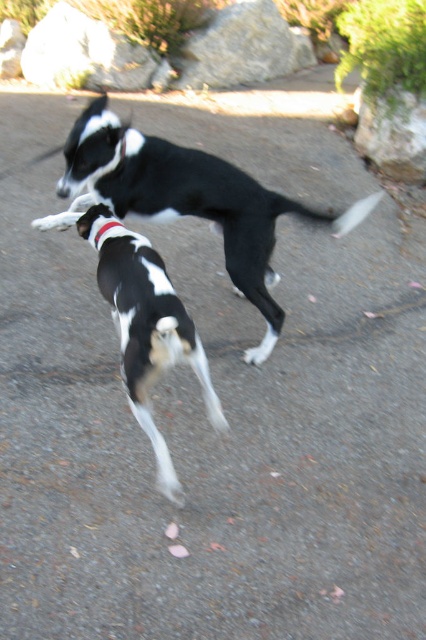
Does black and white fur at center appear on the right side of red fabric neckband at center?

Indeed, black and white fur at center is positioned on the right side of red fabric neckband at center.

Measure the distance between point [150,340] and camera.

They are 7.26 feet apart.

Find the location of a particular element. Image resolution: width=426 pixels, height=640 pixels. black and white fur at center is located at coordinates (150, 336).

Looking at this image, is black and white fur dog at center bigger than red fabric neckband at center?

Indeed, black and white fur dog at center has a larger size compared to red fabric neckband at center.

Consider the image. Does black and white fur dog at center have a greater width compared to red fabric neckband at center?

Yes.

This screenshot has width=426, height=640. What do you see at coordinates (187, 200) in the screenshot?
I see `black and white fur dog at center` at bounding box center [187, 200].

Where is `black and white fur dog at center`? The image size is (426, 640). black and white fur dog at center is located at coordinates (187, 200).

Is point (370, 196) in front of point (207, 400)?

No, (370, 196) is further to viewer.

Which is behind, point (63, 216) or point (164, 355)?

Positioned behind is point (63, 216).

What are the coordinates of `black and white fur dog at center` in the screenshot? It's located at (187, 200).